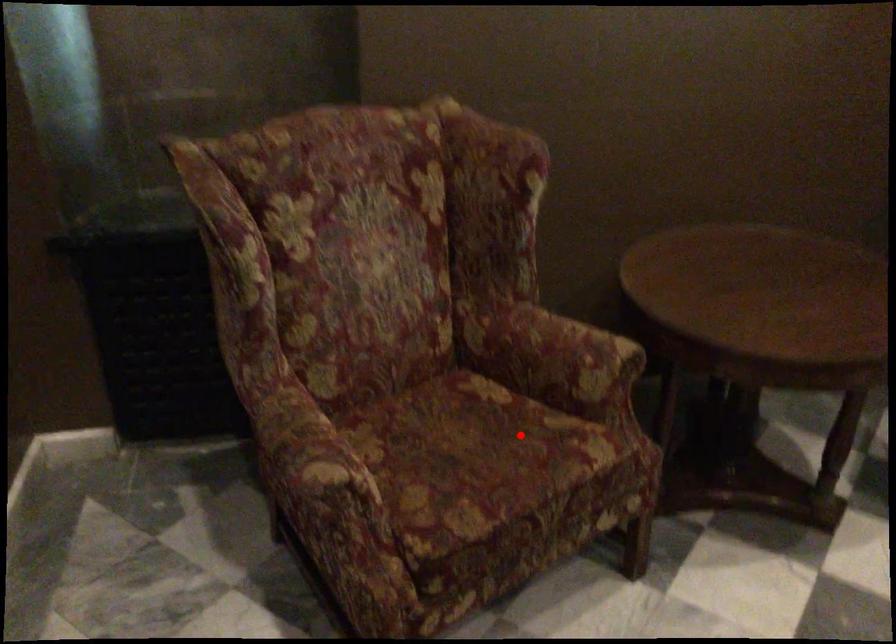
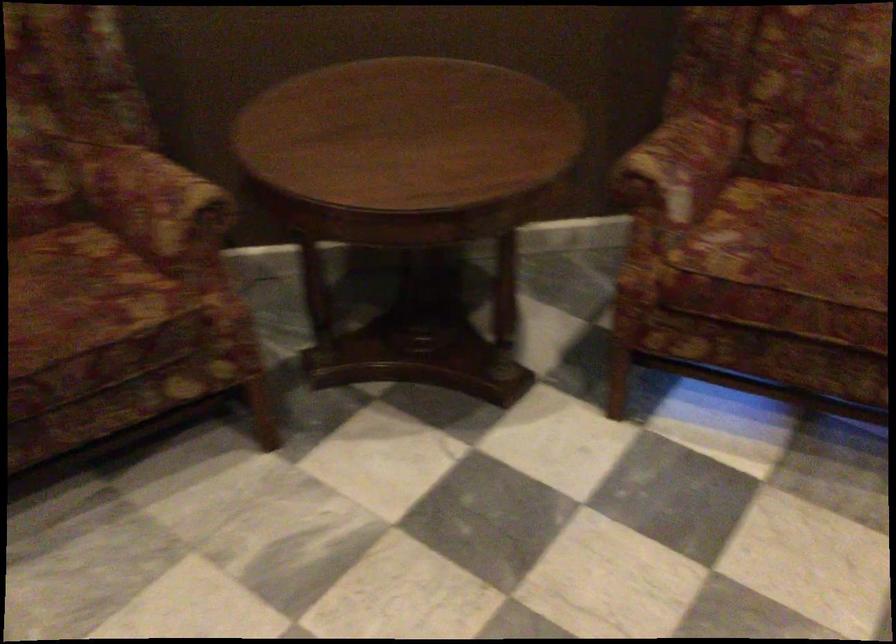
Where in the second image is the point corresponding to the highlighted location from the first image?

(80, 292)